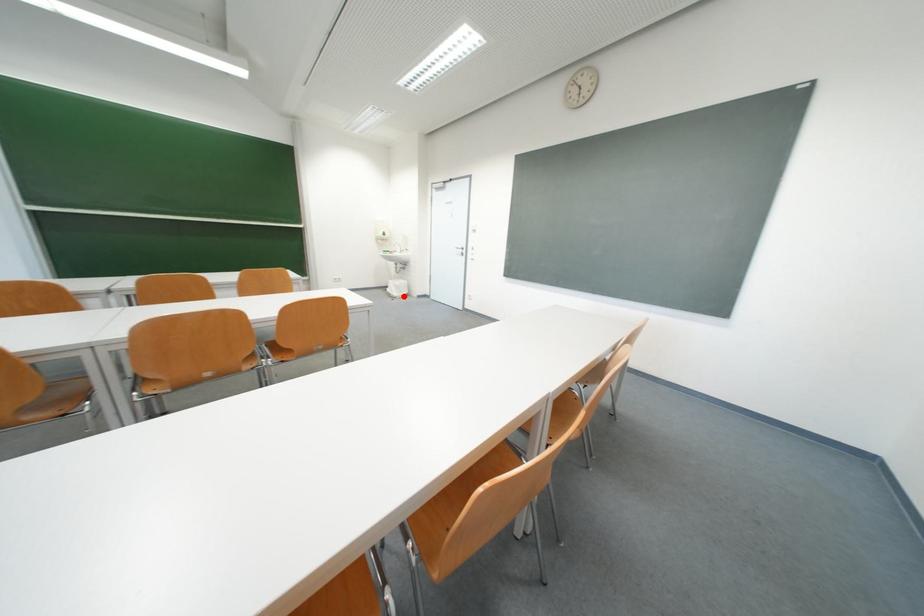
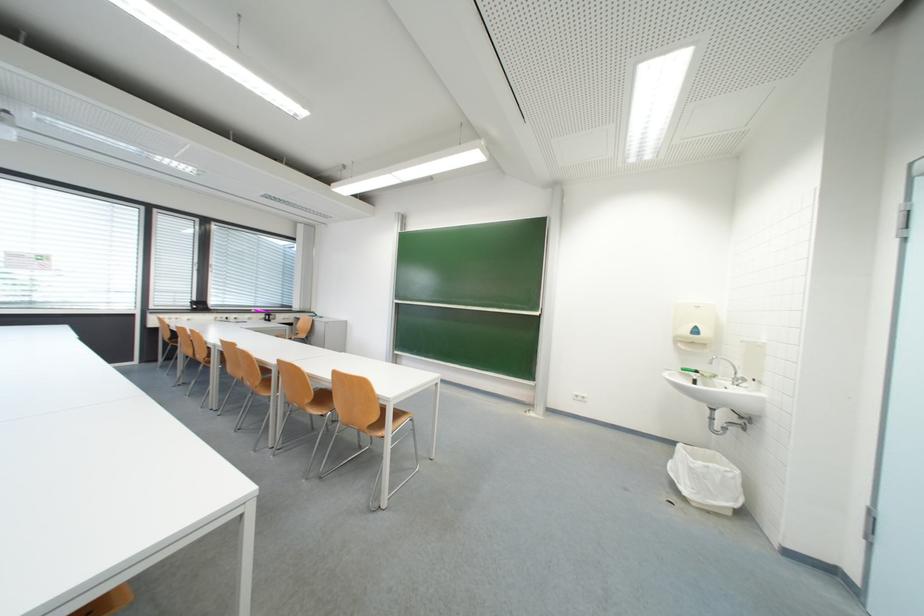
Where in the second image is the point corresponding to the highlighted location from the first image?

(695, 493)